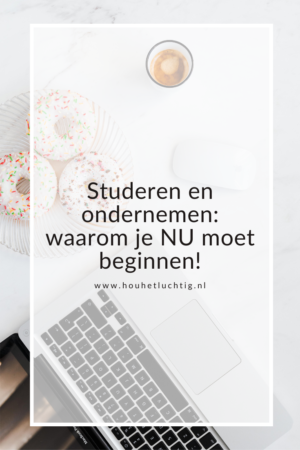
The width and height of the screenshot is (300, 450). Identify the location of mouse. (212, 165).